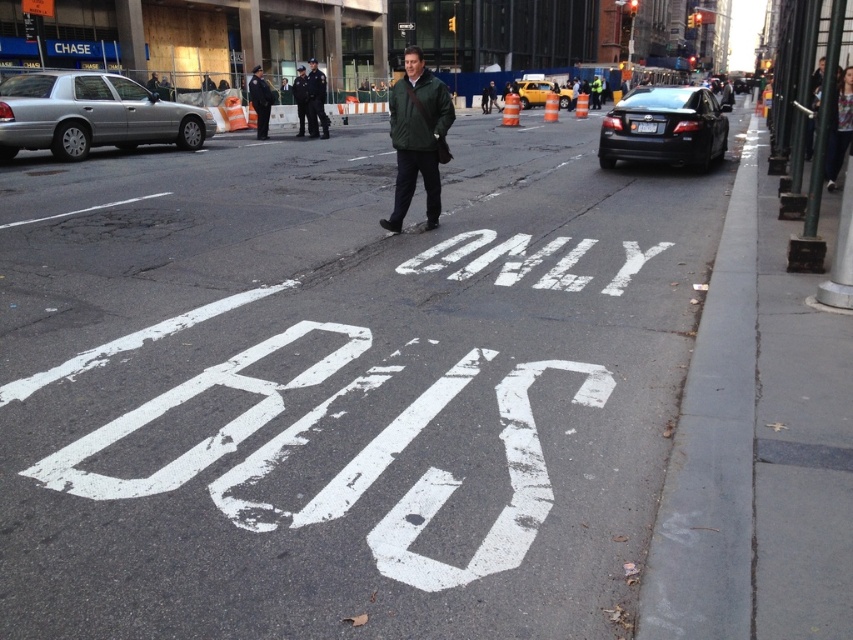
Question: Can you confirm if shiny black sedan at right is smaller than dark blue uniform at center?

Choices:
 (A) yes
 (B) no

Answer: (B)

Question: Which of the following is the closest to the observer?

Choices:
 (A) black leather jacket at center
 (B) yellow matte taxi at center

Answer: (A)

Question: Which point is farther from the camera taking this photo?

Choices:
 (A) (525, 81)
 (B) (496, 284)
 (C) (836, 145)

Answer: (A)

Question: Which is nearer to the shiny black sedan at right?

Choices:
 (A) white painted text at center
 (B) green matte jacket at center
 (C) dark blue jeans at center

Answer: (C)

Question: Is white painted text at center above dark blue uniform at center?

Choices:
 (A) no
 (B) yes

Answer: (A)

Question: Can you confirm if white painted text at center is wider than green matte jacket at center?

Choices:
 (A) no
 (B) yes

Answer: (B)